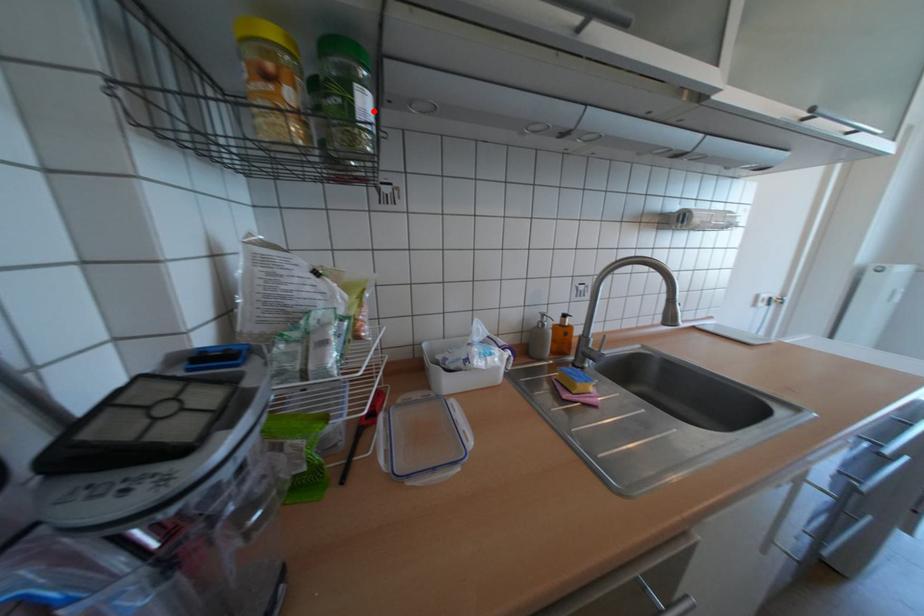
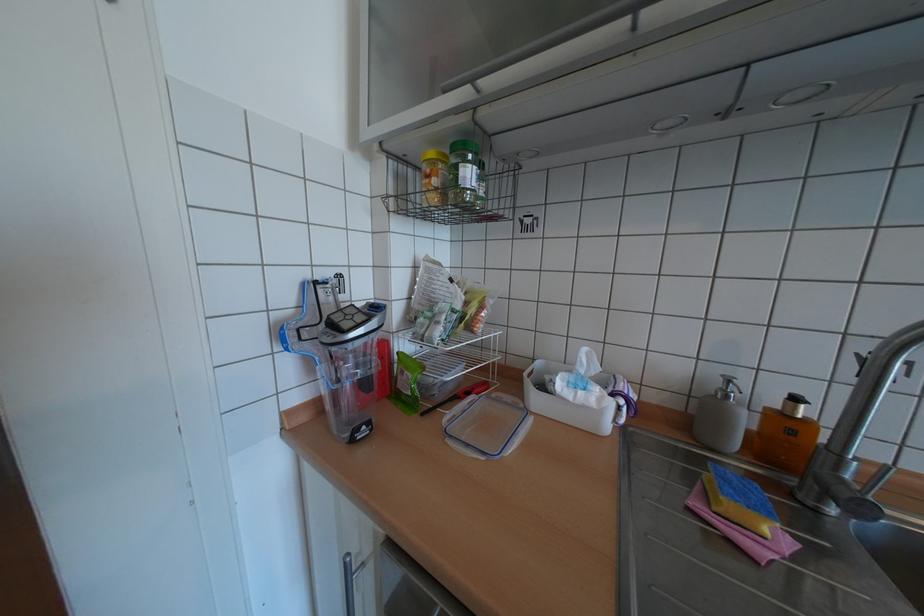
Find the pixel in the second image that matches the highlighted location in the first image.

(473, 177)